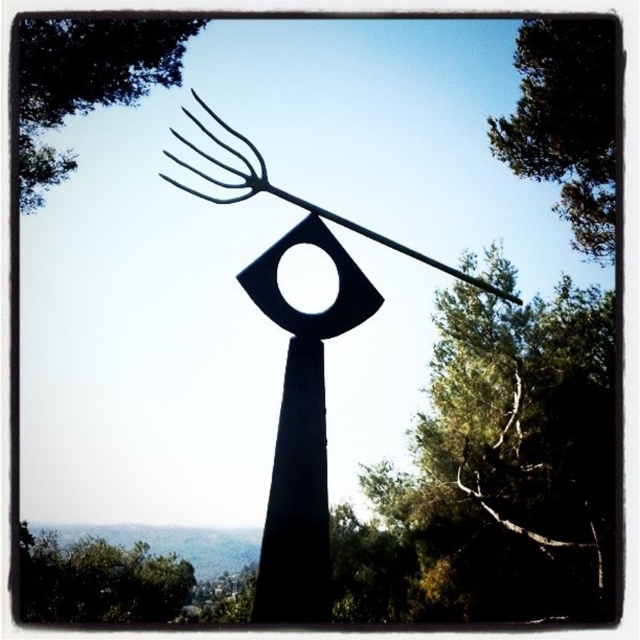
Is green leafy tree at upper center bigger than green leafy tree at upper right?

Indeed, green leafy tree at upper center has a larger size compared to green leafy tree at upper right.

You are a GUI agent. You are given a task and a screenshot of the screen. Output one action in this format:
    pyautogui.click(x=<x>, y=<y>)
    Task: Click on the green leafy tree at upper center
    This screenshot has width=640, height=640.
    Given the screenshot: What is the action you would take?
    pyautogui.click(x=496, y=472)

Describe the element at coordinates (496, 472) in the screenshot. This screenshot has height=640, width=640. I see `green leafy tree at upper center` at that location.

The height and width of the screenshot is (640, 640). In order to click on green leafy tree at upper center in this screenshot , I will do `click(496, 472)`.

At what (x,y) coordinates should I click in order to perform the action: click on green leafy tree at upper right. Please return your answer as a coordinate pair (x, y). Looking at the image, I should click on (566, 124).

Which is in front, point (593, 554) or point (19, 134)?

Positioned in front is point (19, 134).

Does green leafy tree at upper center have a greater height compared to green leafy tree at upper left?

Yes.

Locate an element on the screen. The image size is (640, 640). green leafy tree at upper center is located at coordinates (496, 472).